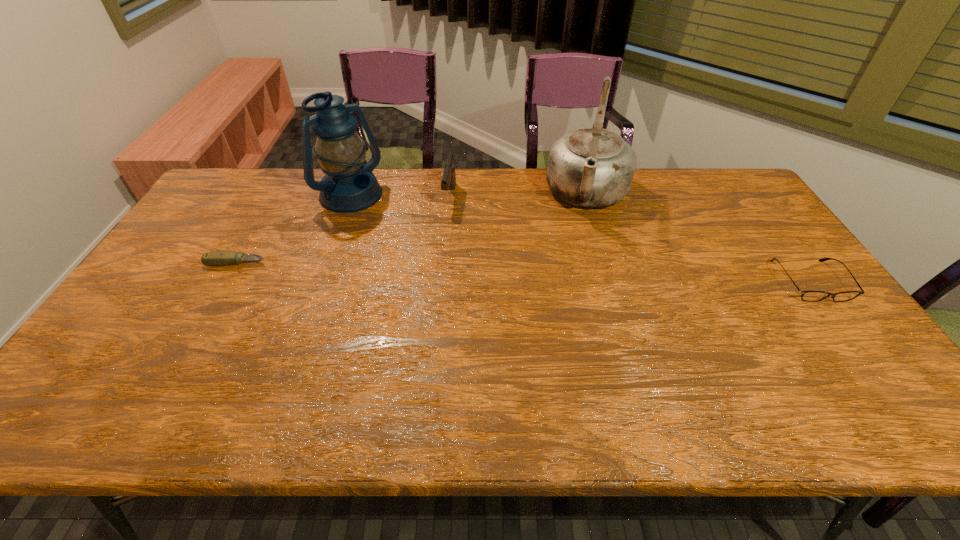
Where is `vacant area situated 0.130m at the spout of the fourth object from left to right`? This screenshot has width=960, height=540. vacant area situated 0.130m at the spout of the fourth object from left to right is located at coordinates click(580, 251).

The width and height of the screenshot is (960, 540). I want to click on vacant area situated at the spout of the fourth object from left to right, so click(x=577, y=262).

The width and height of the screenshot is (960, 540). What are the coordinates of `vacant space located at the spout of the fourth object from left to right` in the screenshot? It's located at (574, 278).

Where is `vacant space located aim along the barrel of the third object from left to right`? The width and height of the screenshot is (960, 540). vacant space located aim along the barrel of the third object from left to right is located at coordinates (434, 277).

Image resolution: width=960 pixels, height=540 pixels. In order to click on vacant space located aim along the barrel of the third object from left to right in this screenshot , I will do `click(432, 282)`.

This screenshot has width=960, height=540. Find the location of `vacant space located aim along the barrel of the third object from left to right`. vacant space located aim along the barrel of the third object from left to right is located at coordinates (440, 251).

Locate an element on the screen. This screenshot has height=540, width=960. free point located on the face of the fourth object from right to left is located at coordinates (431, 272).

Find the location of a particular element. The height and width of the screenshot is (540, 960). free space located on the face of the fourth object from right to left is located at coordinates (397, 242).

Image resolution: width=960 pixels, height=540 pixels. I want to click on blank space located 0.250m on the face of the fourth object from right to left, so click(411, 254).

Find the location of a particular element. kettle that is positioned at the far edge is located at coordinates (593, 167).